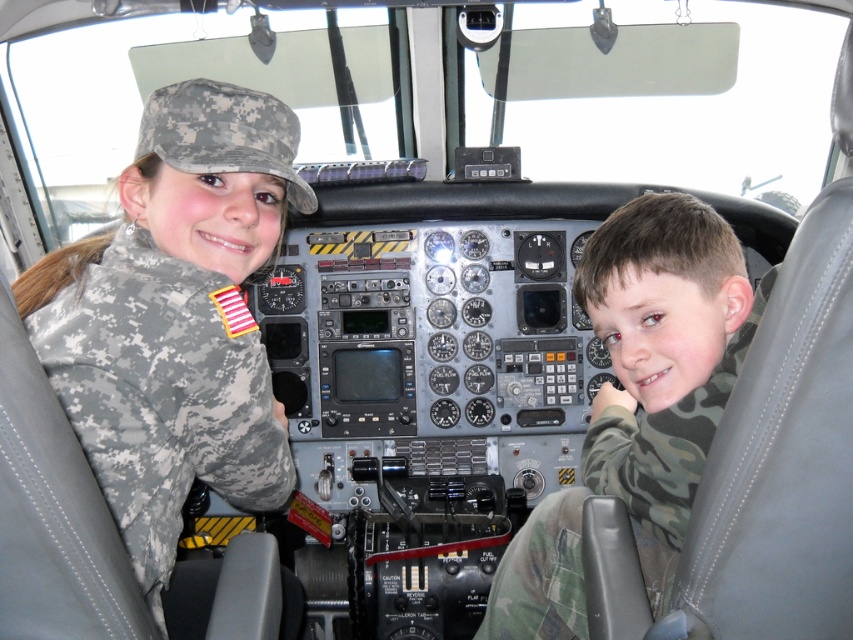
You are a military inspector checking the cockpit. You notice two camouflage items in the cockpit. Which one is higher up, the camouflage uniform at left or the camouflage fabric shirt at center?

The camouflage uniform at left is higher up than the camouflage fabric shirt at center because it is positioned above it.

You are a military inspector checking the cockpit. You need to ensure that the camouflage uniform at left and the camouflage fabric shirt at center are arranged properly. According to the cockpit layout, which object is positioned to the left of the other?

The camouflage uniform at left is positioned to the left of the camouflage fabric shirt at center.

You are a technician inspecting the cockpit. You notice a point at coordinates (175, 317). Based on the scene description, which object is this point located on?

The point at coordinates (175, 317) is located on the camouflage uniform at left.